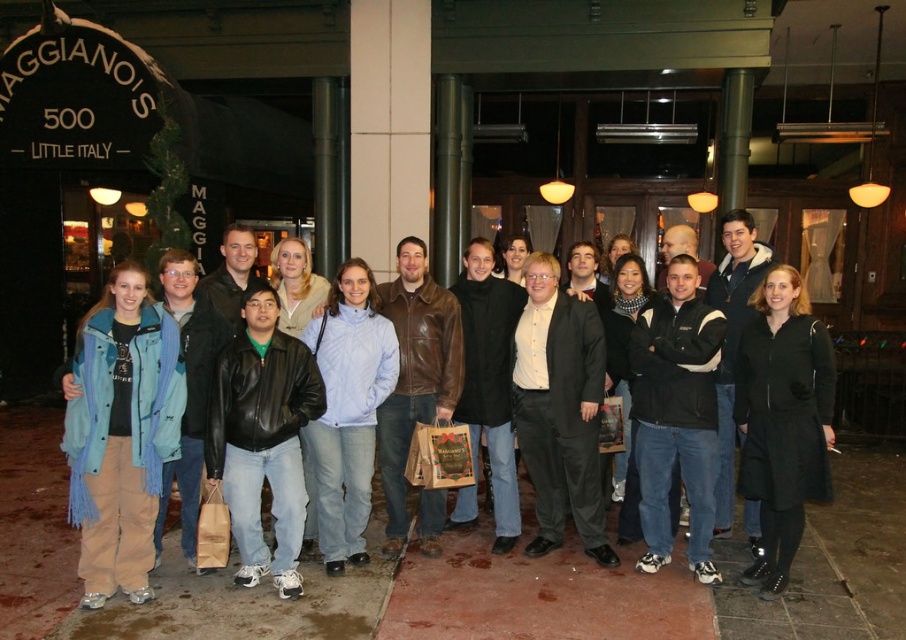
You are a photographer trying to capture a group photo where both the black matte coat at center and the light blue fleece jacket at center are visible. Considering their heights, which clothing item will appear shorter in the photo?

The black matte coat at center appears shorter in the photo since it has a lesser height compared to the light blue fleece jacket at center.